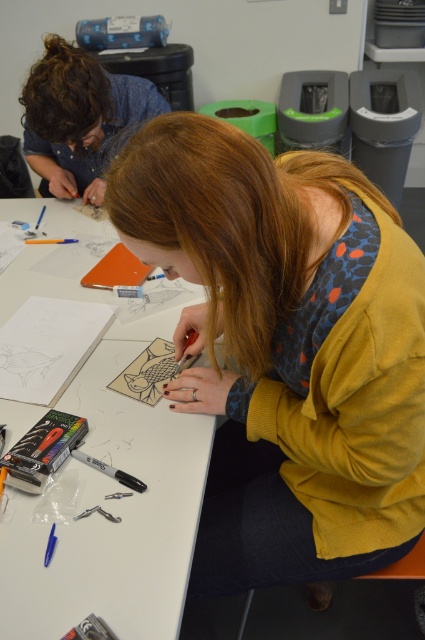
Question: Based on their relative distances, which object is nearer to the curly brown hair at upper left?

Choices:
 (A) black matte pen at center
 (B) matte yellow sweater at center

Answer: (B)

Question: Which object appears farthest from the camera in this image?

Choices:
 (A) black matte pen at center
 (B) matte yellow sweater at center

Answer: (A)

Question: Does matte yellow sweater at center appear on the right side of black matte pen at center?

Choices:
 (A) no
 (B) yes

Answer: (B)

Question: Does matte yellow sweater at center have a greater width compared to curly brown hair at upper left?

Choices:
 (A) yes
 (B) no

Answer: (A)

Question: Which object is closer to the camera taking this photo?

Choices:
 (A) white paper at center
 (B) black matte pen at center
 (C) matte yellow sweater at center

Answer: (C)

Question: Is curly brown hair at upper left to the left of black matte pen at center from the viewer's perspective?

Choices:
 (A) no
 (B) yes

Answer: (B)